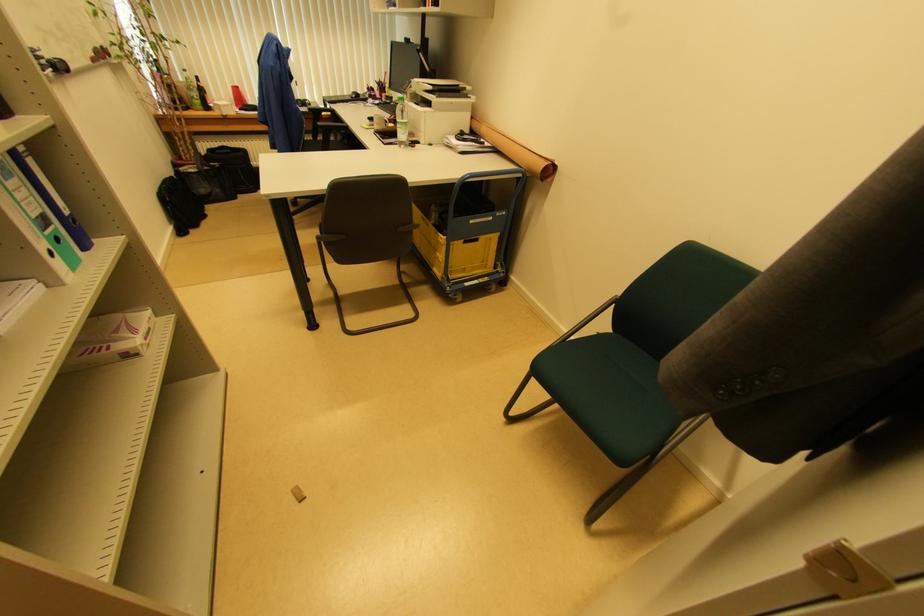
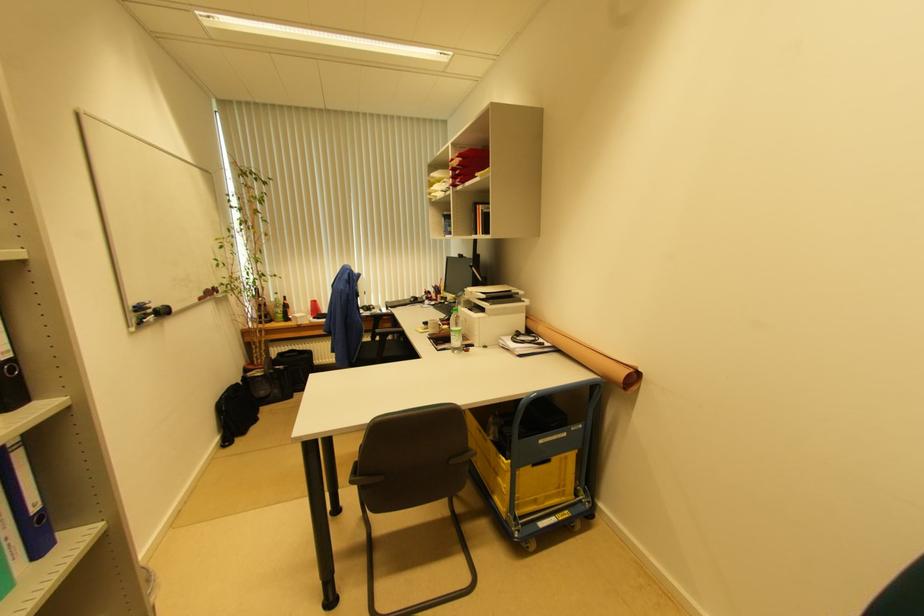
Question: The images are taken continuously from a first-person perspective. In which direction is your viewpoint rotating?

Choices:
 (A) Left
 (B) Right
 (C) Up
 (D) Down

Answer: (C)